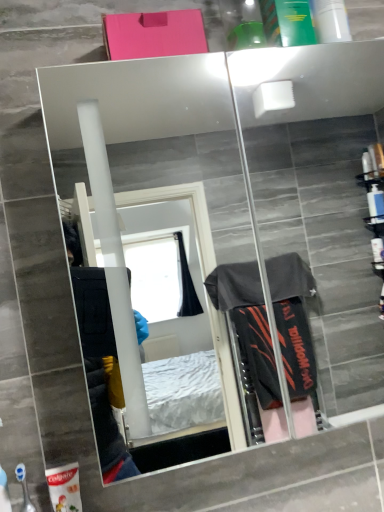
Question: From the image's perspective, is mirror glass at upper center on top of white matte toothpaste tube at lower left, the second toiletry when ordered from front to back?

Choices:
 (A) no
 (B) yes

Answer: (B)

Question: From a real-world perspective, is mirror glass at upper center below white matte toothpaste tube at lower left, the second toiletry when ordered from front to back?

Choices:
 (A) no
 (B) yes

Answer: (A)

Question: Is white matte toothpaste tube at lower left, the second toiletry when ordered from front to back, completely or partially inside mirror glass at upper center?

Choices:
 (A) yes
 (B) no

Answer: (B)

Question: Is mirror glass at upper center wider than white matte toothpaste tube at lower left, the second toiletry when ordered from front to back?

Choices:
 (A) no
 (B) yes

Answer: (B)

Question: Is mirror glass at upper center closer to camera compared to white matte toothpaste tube at lower left, arranged as the first toiletry when viewed from the back?

Choices:
 (A) yes
 (B) no

Answer: (A)

Question: Is white matte toothpaste tube at lower left, arranged as the first toiletry when viewed from the back, to the left or to the right of mirror glass at upper center in the image?

Choices:
 (A) right
 (B) left

Answer: (B)

Question: From the image's perspective, is white matte toothpaste tube at lower left, the second toiletry when ordered from front to back, located above or below mirror glass at upper center?

Choices:
 (A) below
 (B) above

Answer: (A)

Question: In the image, is white matte toothpaste tube at lower left, the second toiletry when ordered from front to back, positioned in front of or behind mirror glass at upper center?

Choices:
 (A) front
 (B) behind

Answer: (B)

Question: Is white matte toothpaste tube at lower left, arranged as the first toiletry when viewed from the back, inside the boundaries of mirror glass at upper center, or outside?

Choices:
 (A) inside
 (B) outside

Answer: (B)

Question: In the image, is blue plastic toothbrush at lower left, which is the 1th toiletry from front to back, positioned in front of or behind mirror glass at upper center?

Choices:
 (A) front
 (B) behind

Answer: (B)

Question: Would you say blue plastic toothbrush at lower left, positioned as the 2th toiletry in back-to-front order, is inside or outside mirror glass at upper center?

Choices:
 (A) outside
 (B) inside

Answer: (A)

Question: From the image's perspective, is blue plastic toothbrush at lower left, positioned as the 2th toiletry in back-to-front order, above or below mirror glass at upper center?

Choices:
 (A) below
 (B) above

Answer: (A)

Question: Is point (24, 496) closer or farther from the camera than point (117, 291)?

Choices:
 (A) closer
 (B) farther

Answer: (A)

Question: From their relative heights in the image, would you say blue plastic toothbrush at lower left, positioned as the 2th toiletry in back-to-front order, is taller or shorter than white matte toothpaste tube at lower left, arranged as the first toiletry when viewed from the back?

Choices:
 (A) tall
 (B) short

Answer: (A)

Question: From a real-world perspective, relative to white matte toothpaste tube at lower left, the second toiletry when ordered from front to back, is blue plastic toothbrush at lower left, which is the 1th toiletry from front to back, vertically above or below?

Choices:
 (A) above
 (B) below

Answer: (A)